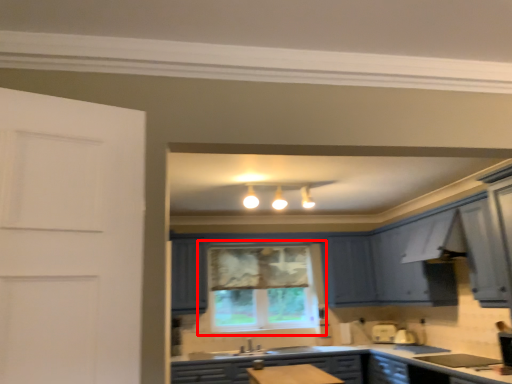
Question: Where is window (annotated by the red box) located in relation to cabinetry in the image?

Choices:
 (A) right
 (B) left

Answer: (B)